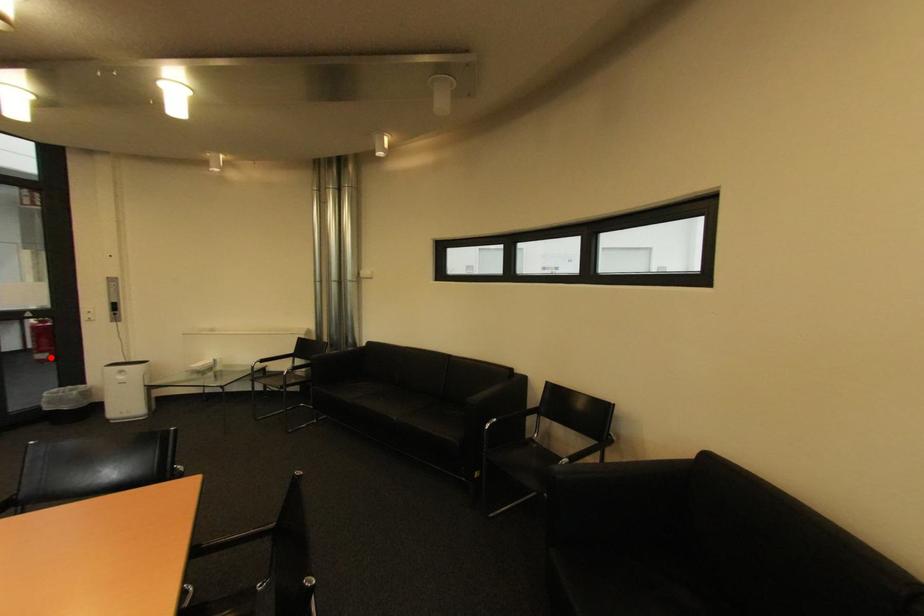
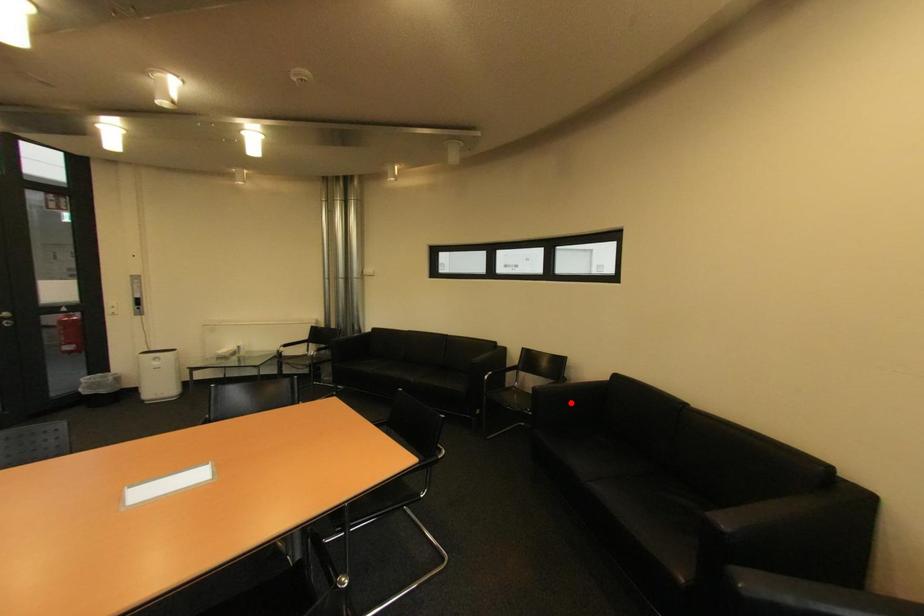
I am providing you with two images of the same scene from different viewpoints. A red point is marked on the first image and another point is marked on the second image. Is the marked point in image1 the same physical position as the marked point in image2?

No